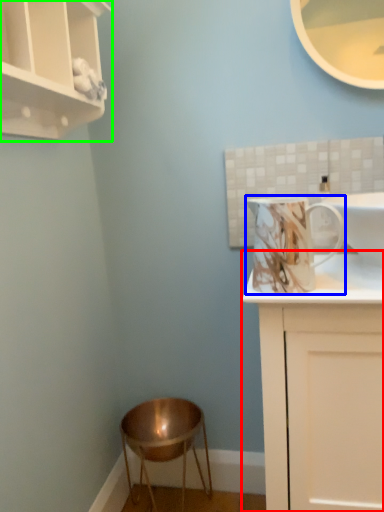
Question: Based on their relative distances, which object is farther from cabinetry (highlighted by a red box)? Choose from mug (highlighted by a blue box) and cupboard (highlighted by a green box).

Choices:
 (A) mug
 (B) cupboard

Answer: (B)